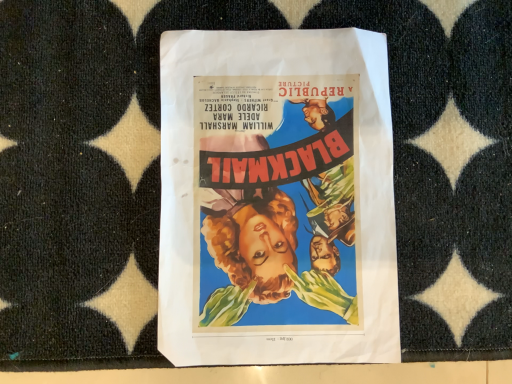
What is the approximate width of vibrant paper poster at center?

12.34 inches.

Measure the distance between point (248, 145) and camera.

Point (248, 145) is 14.84 inches from camera.

You are a GUI agent. You are given a task and a screenshot of the screen. Output one action in this format:
    pyautogui.click(x=<x>, y=<y>)
    Task: Click on the vibrant paper poster at center
    This screenshot has width=512, height=384.
    Given the screenshot: What is the action you would take?
    pyautogui.click(x=277, y=199)

What do you see at coordinates (277, 199) in the screenshot? This screenshot has width=512, height=384. I see `vibrant paper poster at center` at bounding box center [277, 199].

Locate an element on the screen. vibrant paper poster at center is located at coordinates (277, 199).